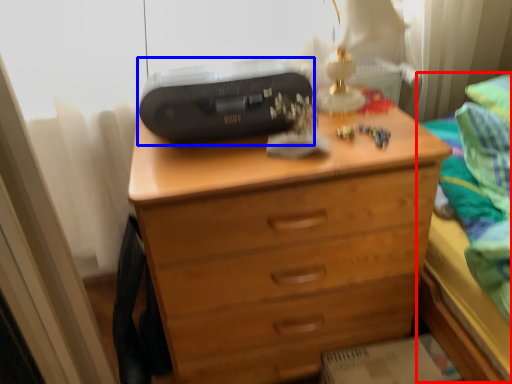
Question: Which object appears farthest to the camera in this image, bed (highlighted by a red box) or printer (highlighted by a blue box)?

Choices:
 (A) bed
 (B) printer

Answer: (B)